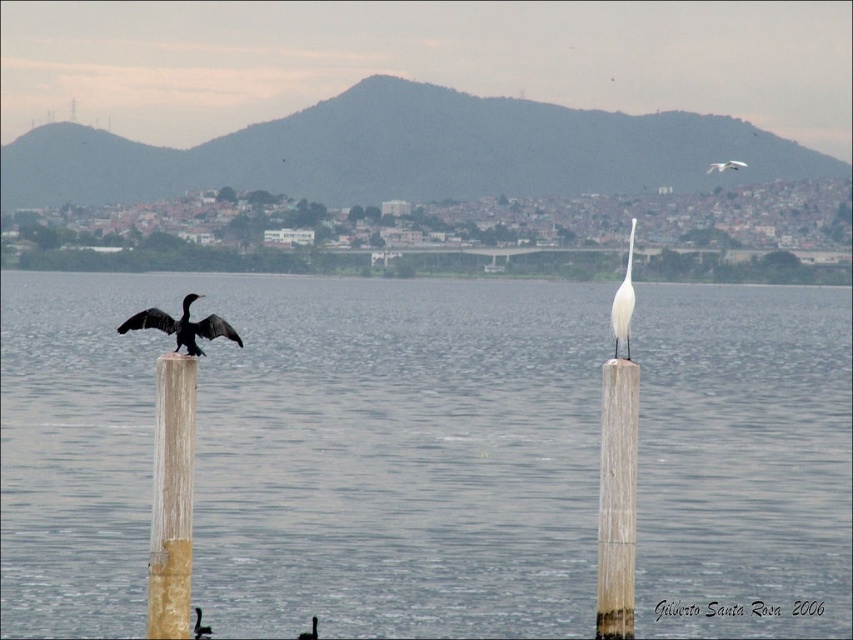
Question: Based on their relative distances, which object is farther from the white glossy egret at upper right?

Choices:
 (A) transparent water at center
 (B) wooden post at center

Answer: (A)

Question: Among these objects, which one is nearest to the camera?

Choices:
 (A) white glossy bird at upper center
 (B) transparent water at center

Answer: (B)

Question: Can you confirm if wooden post at center is positioned above white glossy bird at upper center?

Choices:
 (A) yes
 (B) no

Answer: (B)

Question: Which of the following is the farthest from the observer?

Choices:
 (A) wooden post at center
 (B) white glossy bird at upper center

Answer: (B)

Question: Does wooden post at left appear on the right side of white glossy bird at upper center?

Choices:
 (A) yes
 (B) no

Answer: (B)

Question: Can you confirm if black glossy bird at left is thinner than white glossy egret at upper right?

Choices:
 (A) no
 (B) yes

Answer: (B)